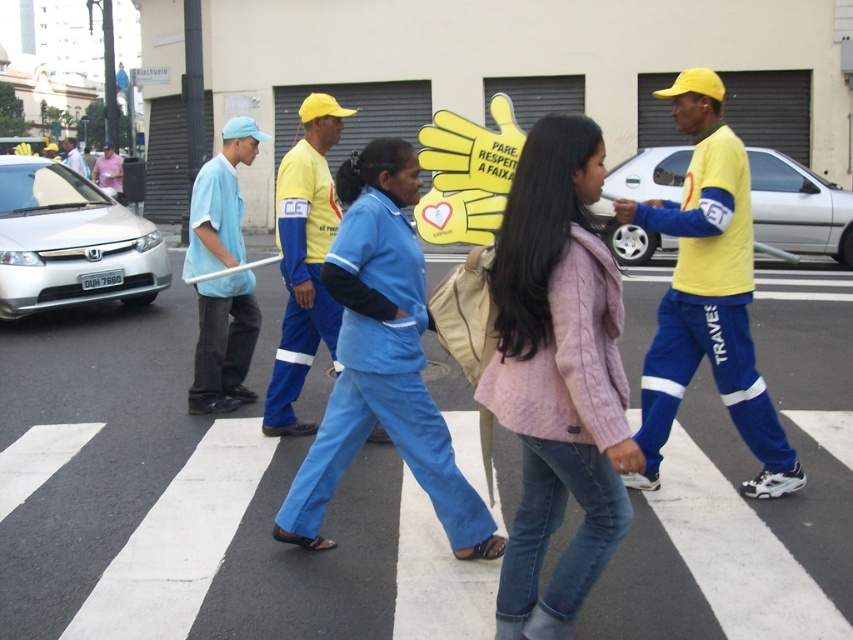
Question: Does blue fabric uniform at center have a greater width compared to matte blue shirt at left?

Choices:
 (A) no
 (B) yes

Answer: (B)

Question: Observing the image, what is the correct spatial positioning of blue fabric uniform at center in reference to matte blue shirt at left?

Choices:
 (A) right
 (B) left

Answer: (A)

Question: Which object appears closest to the camera in this image?

Choices:
 (A) pink textured jacket at center
 (B) matte blue shirt at left
 (C) light blue fabric shirt at center

Answer: (A)

Question: Can you confirm if pink textured jacket at center is wider than light blue fabric shirt at center?

Choices:
 (A) yes
 (B) no

Answer: (B)

Question: Which point is closer to the camera?

Choices:
 (A) (387, 276)
 (B) (283, 429)
 (C) (85, 170)

Answer: (A)

Question: Which object is positioned farthest from the pink textured jacket at center?

Choices:
 (A) matte blue shirt at left
 (B) blue fabric uniform at center
 (C) blue uniform at center
 (D) light blue fabric shirt at center

Answer: (D)